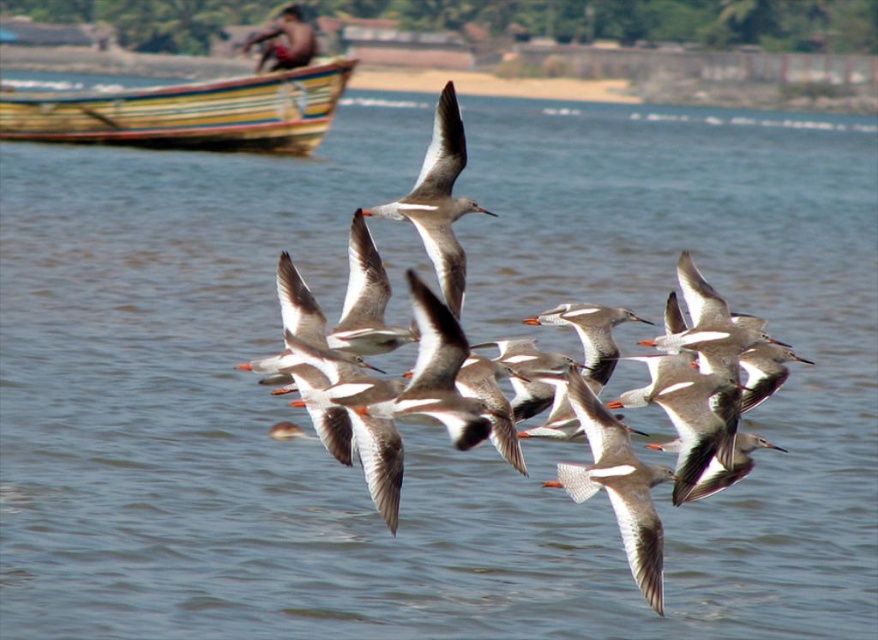
Does wooden painted boat at upper left have a greater width compared to white matte bird at center?

Yes, wooden painted boat at upper left is wider than white matte bird at center.

Find the location of a particular element. The height and width of the screenshot is (640, 878). wooden painted boat at upper left is located at coordinates (191, 113).

Between white feathered bird at center and white matte bird at center, which one appears on the left side from the viewer's perspective?

white matte bird at center is more to the left.

Is point (620, 492) positioned behind point (426, 221)?

No, (620, 492) is in front of (426, 221).

At what (x,y) coordinates should I click in order to perform the action: click on white feathered bird at center. Please return your answer as a coordinate pair (x, y). Looking at the image, I should click on (617, 484).

Looking at this image, does wooden painted boat at upper left appear on the left side of white feathered bird at center?

Yes, wooden painted boat at upper left is to the left of white feathered bird at center.

Can you confirm if wooden painted boat at upper left is thinner than white feathered bird at center?

No.

Who is more distant from viewer, (x=94, y=93) or (x=601, y=445)?

Positioned behind is point (x=94, y=93).

The height and width of the screenshot is (640, 878). Identify the location of wooden painted boat at upper left. (191, 113).